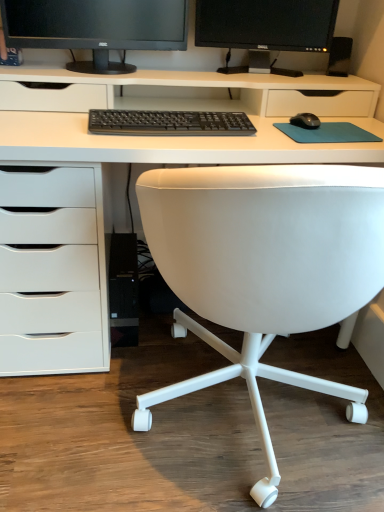
Find the location of a particular element. The height and width of the screenshot is (512, 384). free space above teal fabric mousepad at center (from a real-world perspective) is located at coordinates (338, 127).